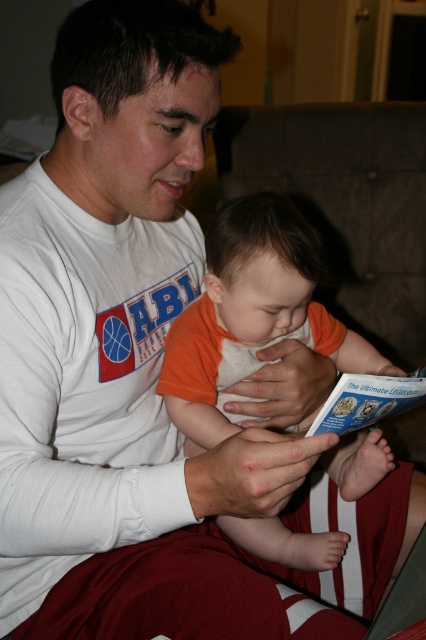
Question: Observing the image, what is the correct spatial positioning of orange cotton shirt at center in reference to blue paper at center?

Choices:
 (A) above
 (B) below

Answer: (A)

Question: Does orange cotton shirt at center appear on the right side of blue paper at center?

Choices:
 (A) yes
 (B) no

Answer: (B)

Question: Which of the following is the farthest from the observer?

Choices:
 (A) (342, 396)
 (B) (265, 205)

Answer: (B)

Question: Is orange cotton shirt at center positioned behind blue paper at center?

Choices:
 (A) yes
 (B) no

Answer: (A)

Question: Which point is closer to the camera taking this photo?

Choices:
 (A) (350, 397)
 (B) (216, 268)

Answer: (A)